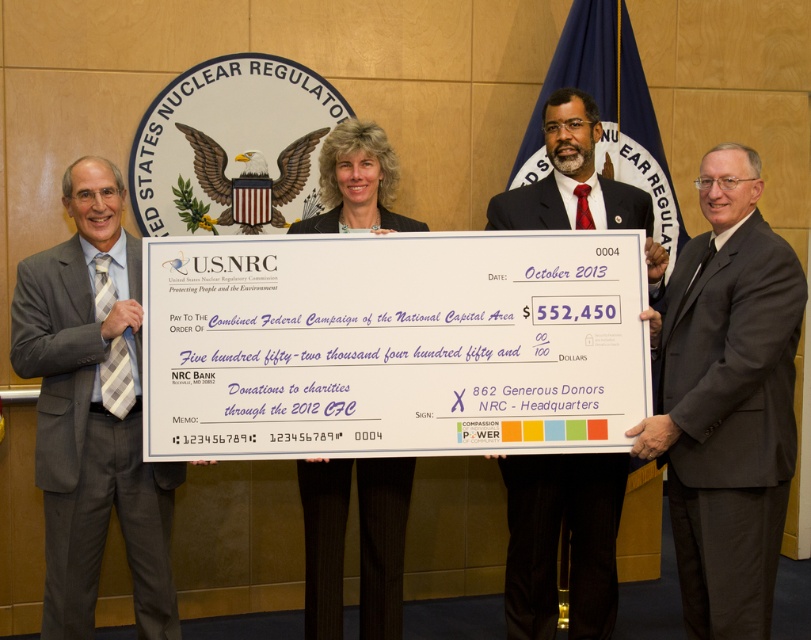
Question: Considering the relative positions of dark suit at center and black pinstripe suit at center in the image provided, where is dark suit at center located with respect to black pinstripe suit at center?

Choices:
 (A) right
 (B) left

Answer: (A)

Question: Which object is positioned farthest from the gray suit at right?

Choices:
 (A) gray suit at left
 (B) dark suit at center
 (C) black pinstripe suit at center

Answer: (A)

Question: Does gray suit at left have a lesser width compared to black pinstripe suit at center?

Choices:
 (A) yes
 (B) no

Answer: (B)

Question: Estimate the real-world distances between objects in this image. Which object is closer to the gray suit at left?

Choices:
 (A) dark suit at center
 (B) gray suit at right

Answer: (A)

Question: Is gray suit at left to the right of dark suit at center from the viewer's perspective?

Choices:
 (A) yes
 (B) no

Answer: (B)

Question: Which point appears farthest from the camera in this image?

Choices:
 (A) (580, 618)
 (B) (84, 557)
 (C) (328, 481)
 (D) (753, 232)

Answer: (A)